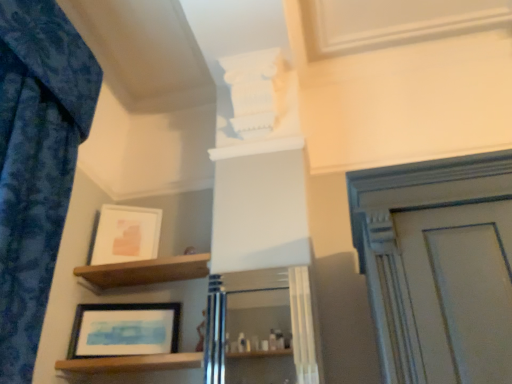
Question: From a real-world perspective, relative to wooden at lower left, which appears as the first shelf when ordered from the bottom, is matte white picture frame at upper left, which is the 2th picture frame from bottom to top, vertically above or below?

Choices:
 (A) below
 (B) above

Answer: (B)

Question: Would you say matte white picture frame at upper left, the second picture frame when ordered from front to back, is to the left or to the right of wooden at lower left, which is counted as the 2th shelf, starting from the top, in the picture?

Choices:
 (A) right
 (B) left

Answer: (B)

Question: Considering the real-world distances, which object is farthest from the matte white picture frame at upper left, the second picture frame when ordered from front to back?

Choices:
 (A) brown wooden shelf at upper center, arranged as the first shelf when viewed from the top
 (B) matte black picture frame at lower left, the first picture frame viewed from the front
 (C) wooden at lower left, which appears as the first shelf when ordered from the bottom
 (D) blue fabric curtain at left
 (E) white glossy cabinet at center

Answer: (E)

Question: Considering the real-world distances, which object is farthest from the blue fabric curtain at left?

Choices:
 (A) white glossy cabinet at center
 (B) matte white picture frame at upper left, which is the 2th picture frame from bottom to top
 (C) wooden at lower left, which is counted as the 2th shelf, starting from the top
 (D) brown wooden shelf at upper center, the 2th shelf when ordered from bottom to top
 (E) matte black picture frame at lower left, the 2th picture frame viewed from the top

Answer: (A)